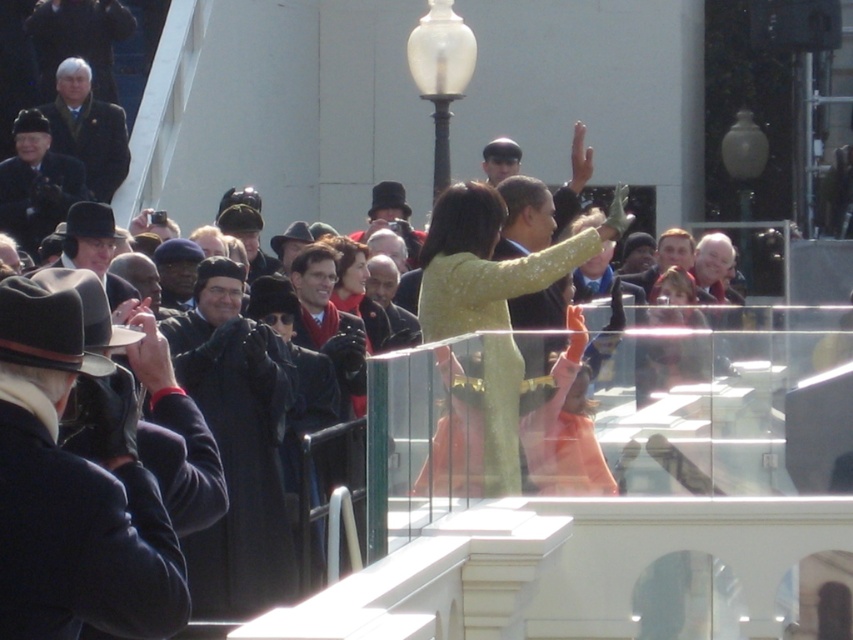
You are a photographer at the event. You want to take a photo that includes both the dark brown leather hat at left and the shiny gold dress at center. Which object should you focus on first to ensure both are in frame?

The dark brown leather hat at left is taller than the shiny gold dress at center. To ensure both are in frame, focus on the taller object first, which is the dark brown leather hat at left.

You are a photographer standing at the back of the crowd, trying to capture a clear photo of both the dark brown leather hat at left and the shiny gold dress at center. The camera you have can focus on subjects up to 15 meters away. Will you be able to capture both subjects in focus?

The distance between the dark brown leather hat at left and the shiny gold dress at center is 13.46 meters. Since your camera can focus up to 15 meters, both subjects are within the camera range, so you can capture both in focus.